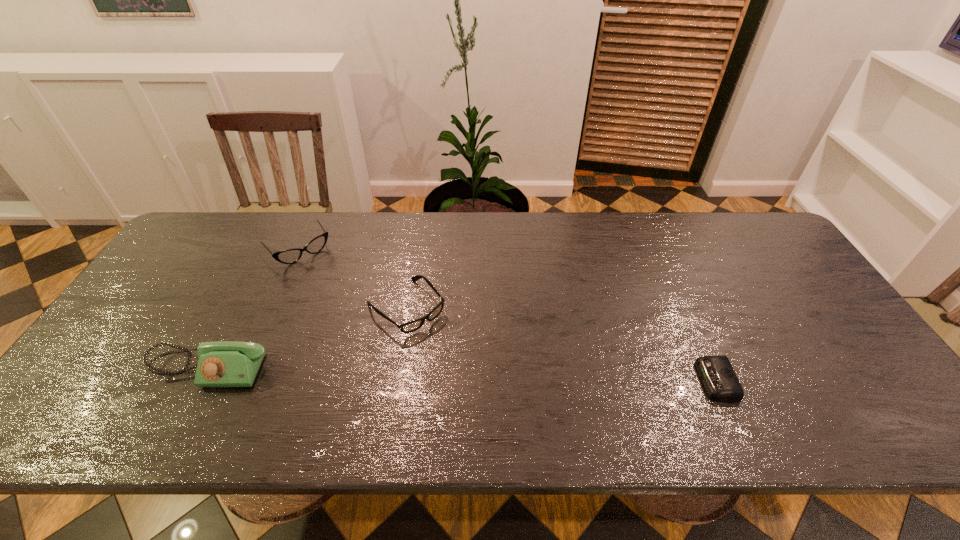
Locate an element on the screen. The height and width of the screenshot is (540, 960). free space on the desktop that is between the telephone and the rightmost object and is positioned on the front-facing side of the nearer spectacles is located at coordinates (472, 375).

Locate an element on the screen. This screenshot has height=540, width=960. vacant space on the desktop that is between the telephone and the alarm clock and is positioned on the front-facing side of the taller spectacles is located at coordinates (395, 373).